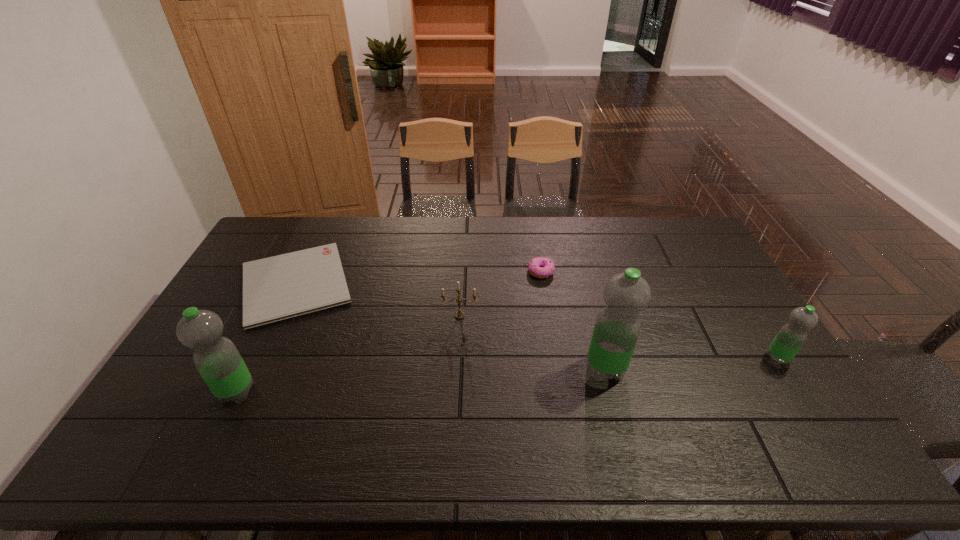
The width and height of the screenshot is (960, 540). Find the location of `the leftmost water bottle`. the leftmost water bottle is located at coordinates (217, 359).

This screenshot has height=540, width=960. In order to click on the fifth shortest object in this screenshot , I will do `click(217, 359)`.

At what (x,y) coordinates should I click in order to perform the action: click on the second water bottle from right to left. Please return your answer as a coordinate pair (x, y). Looking at the image, I should click on (617, 328).

Identify the location of the third tallest object. (790, 338).

The width and height of the screenshot is (960, 540). Identify the location of the shortest water bottle. (790, 338).

Where is `the second shortest object`? the second shortest object is located at coordinates (540, 267).

Image resolution: width=960 pixels, height=540 pixels. I want to click on doughnut, so click(x=540, y=267).

The width and height of the screenshot is (960, 540). In order to click on clipboard in this screenshot , I will do click(x=280, y=287).

Identify the location of the third object from left to right. The height and width of the screenshot is (540, 960). (459, 314).

Find the location of a particular element. The height and width of the screenshot is (540, 960). candle is located at coordinates (459, 314).